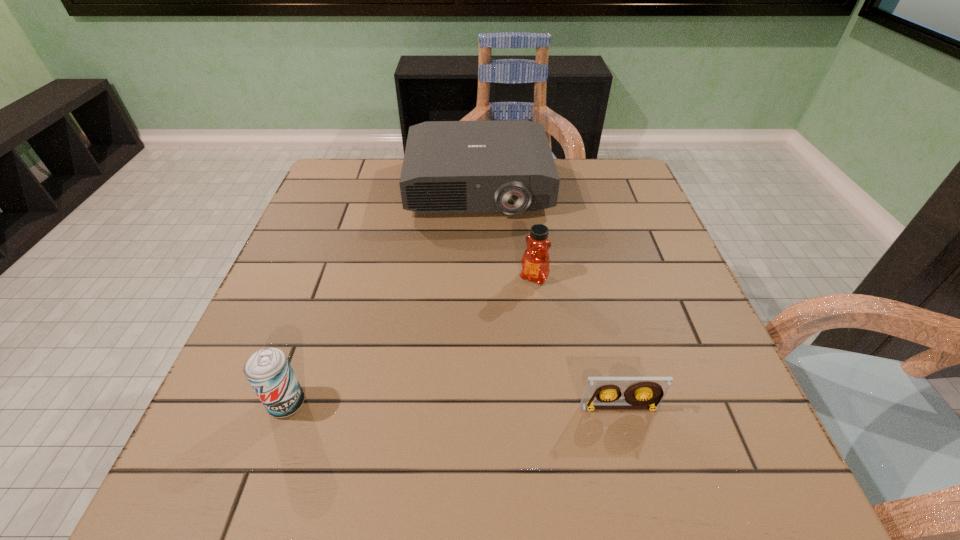
The width and height of the screenshot is (960, 540). Find the location of `the leftmost object`. the leftmost object is located at coordinates (268, 371).

Locate an element on the screen. The width and height of the screenshot is (960, 540). videotape is located at coordinates (601, 393).

You are a GUI agent. You are given a task and a screenshot of the screen. Output one action in this format:
    pyautogui.click(x=<x>, y=<y>)
    Task: Click on the projector
    Image resolution: width=960 pixels, height=540 pixels.
    Given the screenshot: What is the action you would take?
    pyautogui.click(x=507, y=166)

At what (x,y) coordinates should I click in order to perform the action: click on the third nearest object. Please return your answer as a coordinate pair (x, y). Looking at the image, I should click on (535, 262).

In order to click on vacant region located on the right of the leftmost object in this screenshot , I will do `click(502, 403)`.

Find the location of a particular element. This screenshot has height=540, width=960. blank area located 0.290m on the front-facing side of the projector is located at coordinates (486, 303).

Where is `vacant space located on the front-facing side of the projector`? vacant space located on the front-facing side of the projector is located at coordinates (484, 280).

At what (x,y) coordinates should I click in order to perform the action: click on vacant space located on the front-facing side of the projector. Please return your answer as a coordinate pair (x, y). The image size is (960, 540). Looking at the image, I should click on (482, 243).

At what (x,y) coordinates should I click in order to perform the action: click on free space located on the front label of the honey. Please return your answer as a coordinate pair (x, y). This screenshot has width=960, height=540. Looking at the image, I should click on (460, 397).

Locate an element on the screen. vacant space situated 0.310m on the front label of the honey is located at coordinates (460, 397).